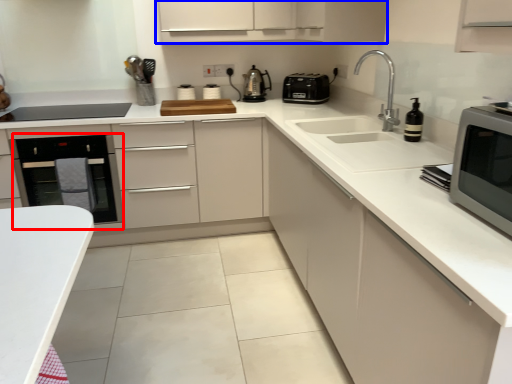
Question: Among these objects, which one is nearest to the camera, oven (highlighted by a red box) or cabinetry (highlighted by a blue box)?

Choices:
 (A) oven
 (B) cabinetry

Answer: (A)